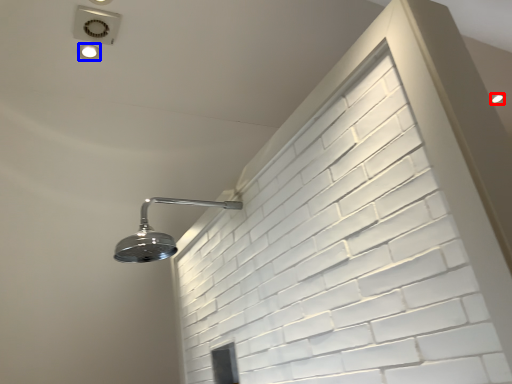
Question: Which object is further to the camera taking this photo, droplight (highlighted by a red box) or droplight (highlighted by a blue box)?

Choices:
 (A) droplight
 (B) droplight

Answer: (A)